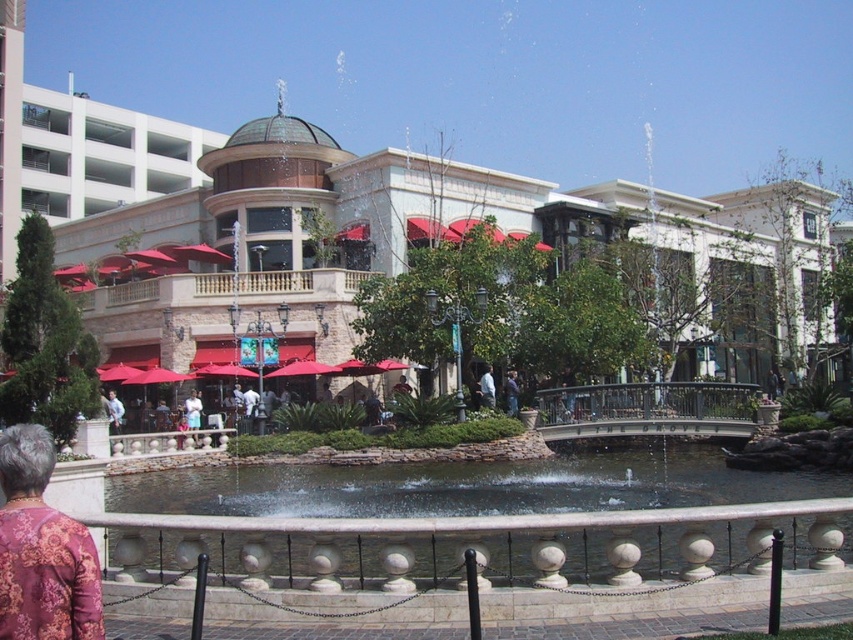
You are standing at the entrance of the shopping district and see the fountain with its decorative balusters and black metal railings. There is also a patterned fabric jacket at lower left represented by point [42,548]. Which object is closer to you, the fountain or the patterned fabric jacket at lower left?

The patterned fabric jacket at lower left is closer to you because it is represented by point [42,548], which is closer to the viewer than the fountain in the foreground.

You are standing at the entrance of the shopping district and see the white fabric person at center and the blue denim jeans at center. Which one is nearer to you?

The white fabric person at center is closer to the viewer than the blue denim jeans at center.